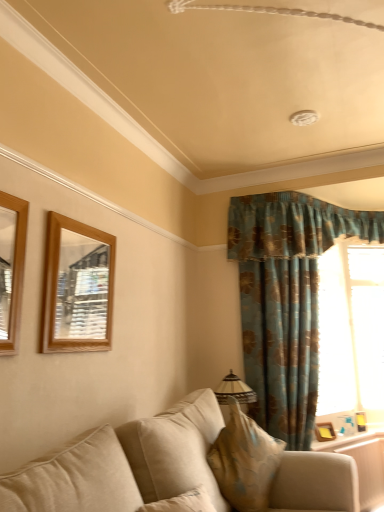
Question: Considering the positions of wooden picture frame at right, arranged as the first picture frame when viewed from the right, and wooden frame at lower right in the image, is wooden picture frame at right, arranged as the first picture frame when viewed from the right, bigger or smaller than wooden frame at lower right?

Choices:
 (A) big
 (B) small

Answer: (B)

Question: In terms of width, does wooden picture frame at right, the 1th picture frame positioned from the back, look wider or thinner when compared to wooden frame at lower right?

Choices:
 (A) thin
 (B) wide

Answer: (A)

Question: Which of these objects is positioned closest to the transparent glass window at right?

Choices:
 (A) beige fabric couch at lower center
 (B) wooden picture frame at right, marked as the 1th picture frame in a bottom-to-top arrangement
 (C) wooden frame at lower right
 (D) matte beige lampshade at center
 (E) wooden mirror at upper left, the 3th picture frame positioned from the right

Answer: (B)

Question: Which object is the farthest from the teal floral fabric curtain at right?

Choices:
 (A) beige fabric couch at lower center
 (B) wooden mirror at upper left, the 3th picture frame positioned from the right
 (C) wooden picture frame at right, marked as the 1th picture frame in a bottom-to-top arrangement
 (D) wooden mirror at left, the fourth picture frame when ordered from right to left
 (E) matte beige lampshade at center

Answer: (D)